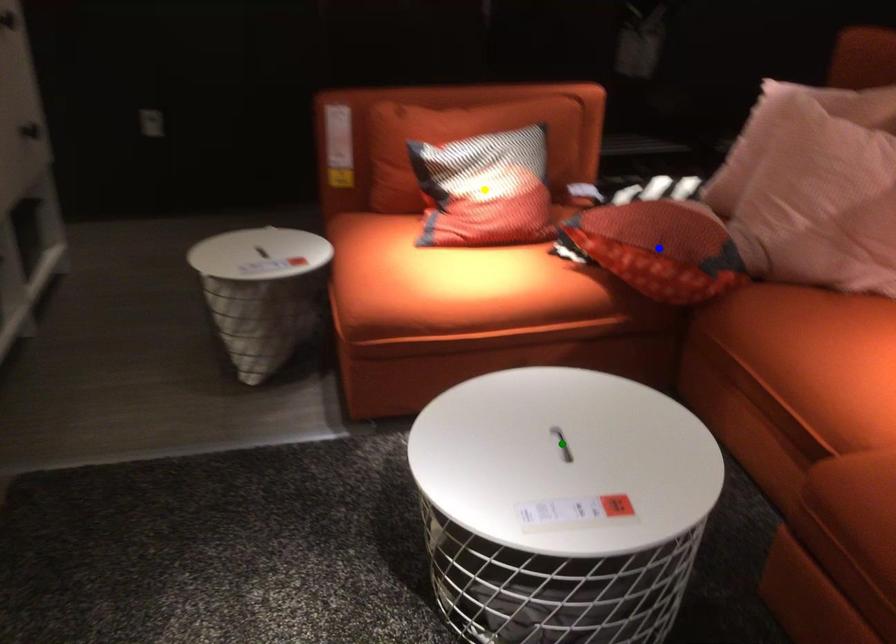
Order these from nearest to farthest:
yellow point
blue point
green point

green point → blue point → yellow point